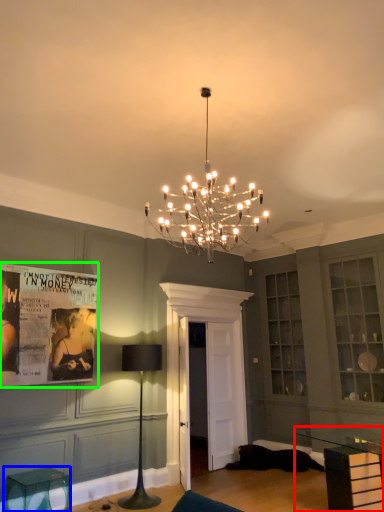
Question: Considering the real-world distances, which object is closest to table (highlighted by a red box)? furniture (highlighted by a blue box) or poster page (highlighted by a green box).

Choices:
 (A) furniture
 (B) poster page

Answer: (A)